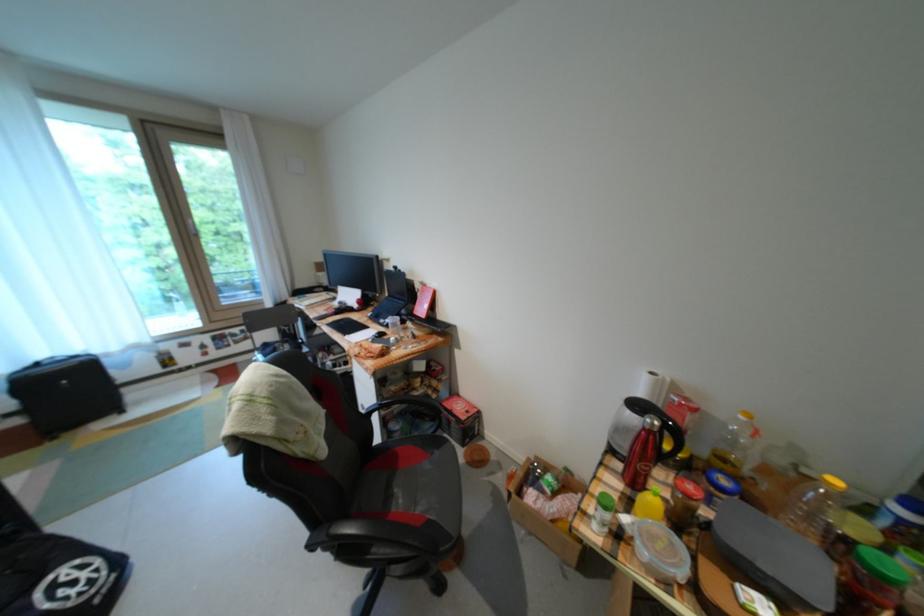
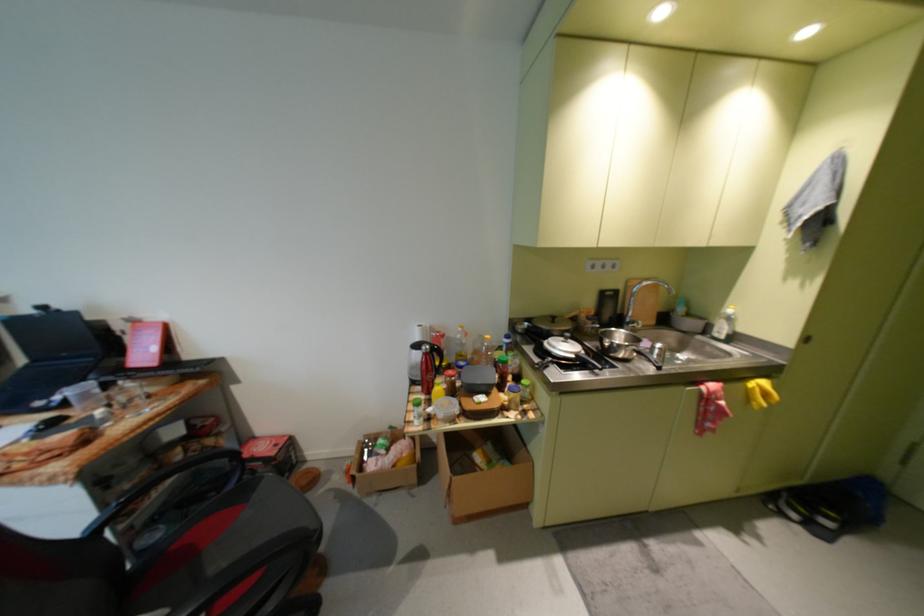
Locate, in the second image, the point that corresponds to pixel 468 395 in the first image.

(264, 439)